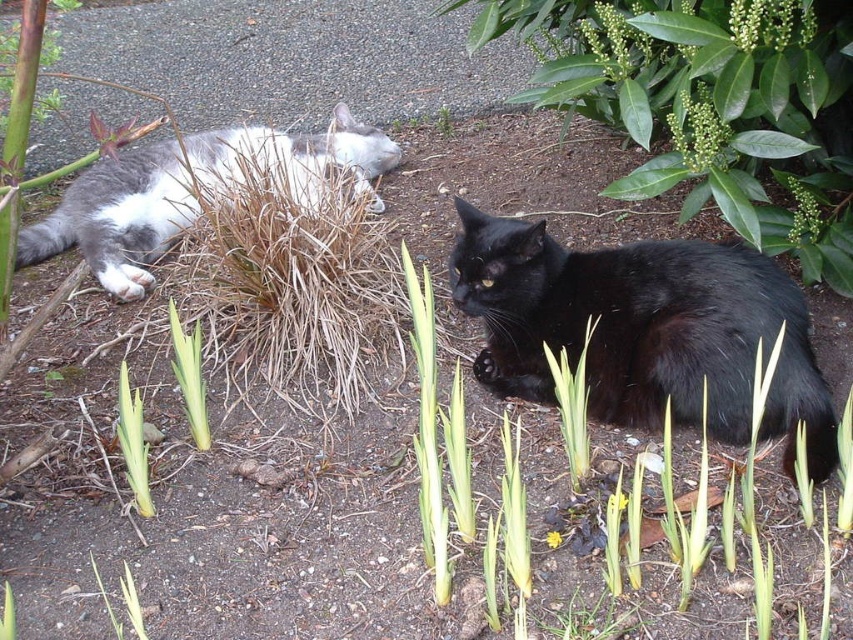
Question: Which object is the farthest from the green leafy bush at upper right?

Choices:
 (A) green leafy plant at lower left
 (B) green leafy plant at center

Answer: (A)

Question: Which point is closer to the camera taking this photo?

Choices:
 (A) (650, 328)
 (B) (321, 134)

Answer: (A)

Question: Is green leafy bush at upper right bigger than gray-white fur cat at left?

Choices:
 (A) yes
 (B) no

Answer: (A)

Question: Can you confirm if black silky cat at center is positioned to the left of gray-white fur cat at left?

Choices:
 (A) no
 (B) yes

Answer: (A)

Question: Does green leafy bush at upper right have a lesser width compared to black silky cat at center?

Choices:
 (A) no
 (B) yes

Answer: (A)

Question: Which of these objects is positioned farthest from the green leafy plant at lower left?

Choices:
 (A) black silky cat at center
 (B) green leafy plant at center

Answer: (A)